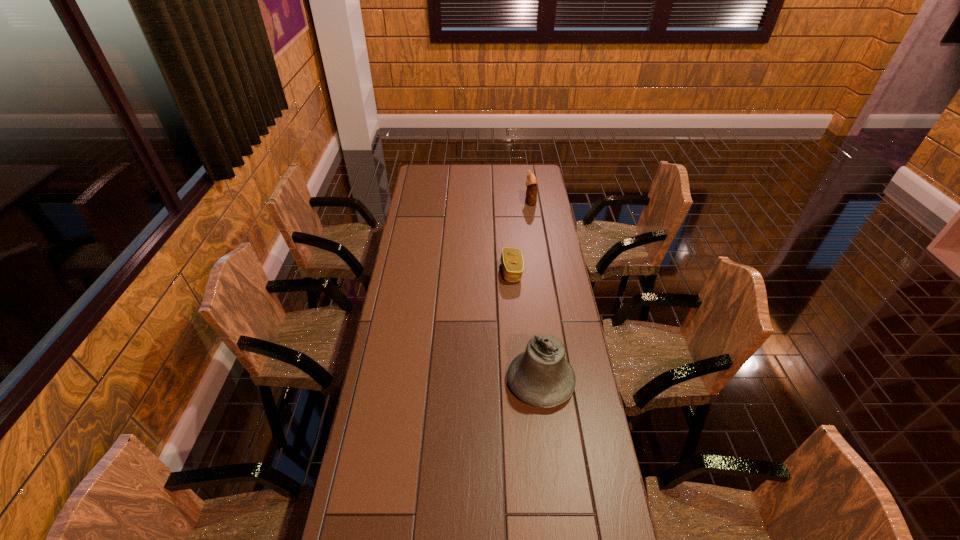
You are a GUI agent. You are given a task and a screenshot of the screen. Output one action in this format:
    pyautogui.click(x=<x>, y=<y>)
    Task: Click on the vacant position in the image that satisfies the following two spatial constraints: 1. on the zipper side of the shortest object; 2. on the right side of the nearest object
    
    Given the screenshot: What is the action you would take?
    pyautogui.click(x=520, y=382)